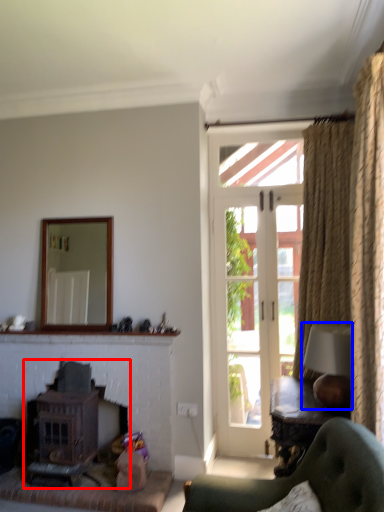
Question: Which of the following is the farthest to the observer, fireplace (highlighted by a red box) or lamp (highlighted by a blue box)?

Choices:
 (A) fireplace
 (B) lamp

Answer: (A)